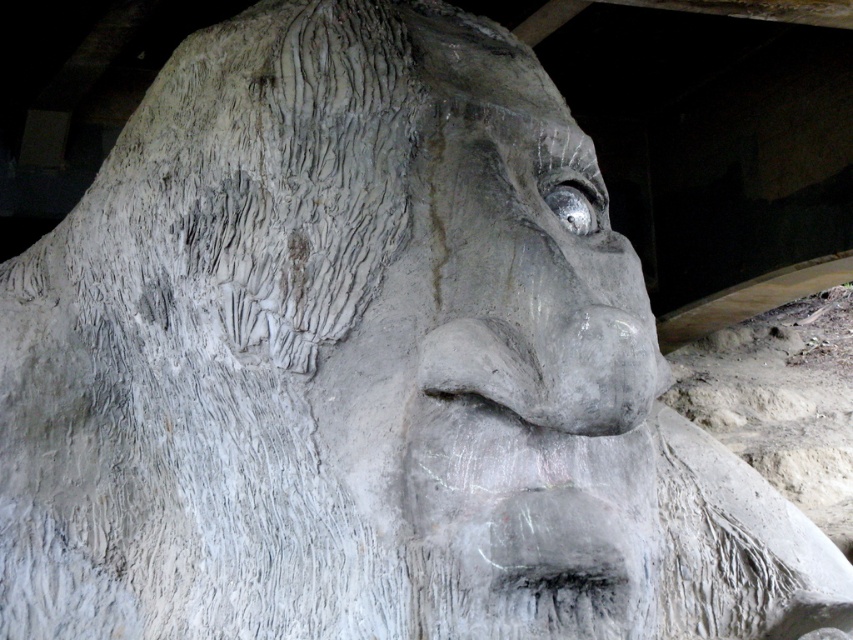
Who is shorter, gray stone face at center or gray textured nose at center?

With less height is gray textured nose at center.

Can you confirm if gray stone face at center is smaller than gray textured nose at center?

No, gray stone face at center is not smaller than gray textured nose at center.

Does point (636, 465) come closer to viewer compared to point (466, 392)?

No, (636, 465) is behind (466, 392).

Identify the location of gray stone face at center. This screenshot has height=640, width=853. (502, 365).

This screenshot has width=853, height=640. What do you see at coordinates (482, 364) in the screenshot? I see `gray textured nose at center` at bounding box center [482, 364].

Can you confirm if gray textured nose at center is positioned to the left of metallic reflective eye at upper center?

Indeed, gray textured nose at center is positioned on the left side of metallic reflective eye at upper center.

The image size is (853, 640). Find the location of `gray textured nose at center`. gray textured nose at center is located at coordinates (482, 364).

Identify the location of gray textured nose at center. (482, 364).

Is gray stone face at center thinner than metallic reflective eye at upper center?

In fact, gray stone face at center might be wider than metallic reflective eye at upper center.

Which is above, gray stone face at center or metallic reflective eye at upper center?

Positioned higher is metallic reflective eye at upper center.

Identify the location of gray stone face at center. This screenshot has width=853, height=640. (502, 365).